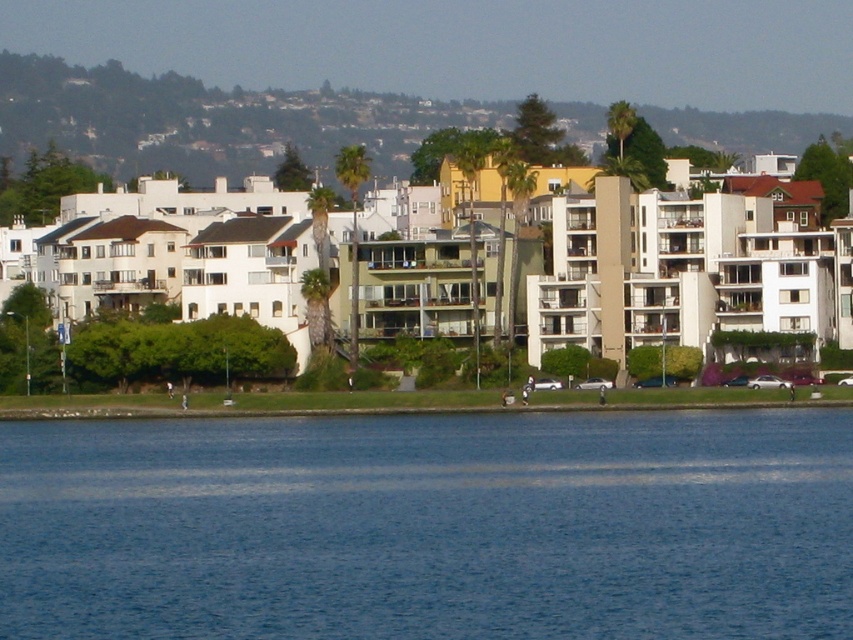
Which of these two, blue water at lower center or green leafy hillside at upper center, stands taller?

Standing taller between the two is green leafy hillside at upper center.

The width and height of the screenshot is (853, 640). I want to click on blue water at lower center, so (x=430, y=525).

Find the location of a particular element. blue water at lower center is located at coordinates (430, 525).